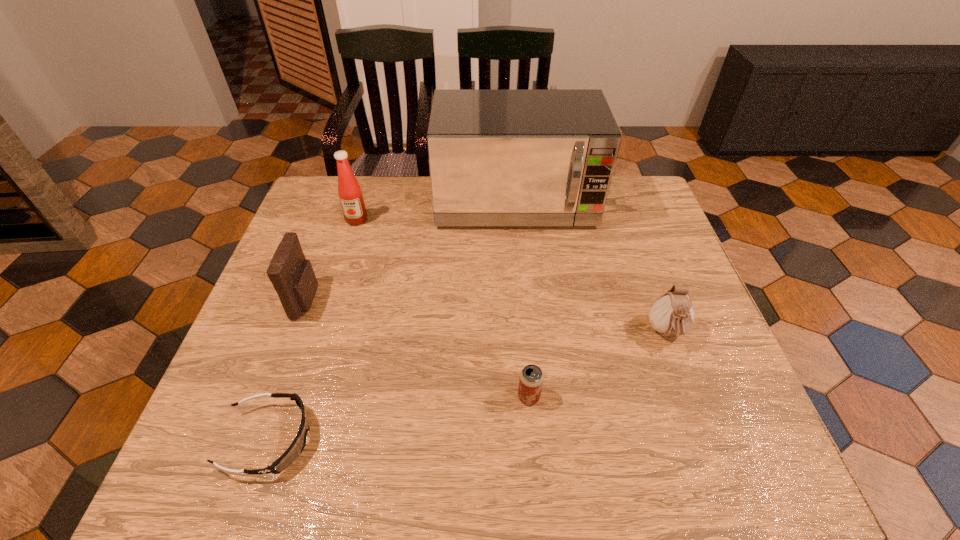
Find the location of a particular element. The image size is (960, 540). free space located 0.080m with an open flap on the left pouch is located at coordinates click(x=351, y=300).

Image resolution: width=960 pixels, height=540 pixels. I want to click on vacant space located 0.120m on the front-facing side of the fourth tallest object, so click(693, 403).

This screenshot has width=960, height=540. Find the location of `free point located on the left of the second shortest object`. free point located on the left of the second shortest object is located at coordinates (342, 396).

The width and height of the screenshot is (960, 540). Find the location of `blank area located 0.200m on the front and sides of the shortest object`. blank area located 0.200m on the front and sides of the shortest object is located at coordinates (417, 439).

Find the location of `microwave oven at the far edge`. microwave oven at the far edge is located at coordinates [x=497, y=157].

This screenshot has width=960, height=540. I want to click on condiment that is positioned at the far edge, so click(x=349, y=191).

This screenshot has width=960, height=540. Identify the location of object that is at the near edge. (295, 449).

You are a GUI agent. You are given a task and a screenshot of the screen. Output one action in this format:
    pyautogui.click(x=<x>, y=<y>)
    Task: Click on the condiment situated at the left edge
    The width and height of the screenshot is (960, 540).
    Given the screenshot: What is the action you would take?
    pyautogui.click(x=349, y=191)

I want to click on pouch at the left edge, so click(x=293, y=278).

Identify the location of goggles at the left edge. (295, 449).